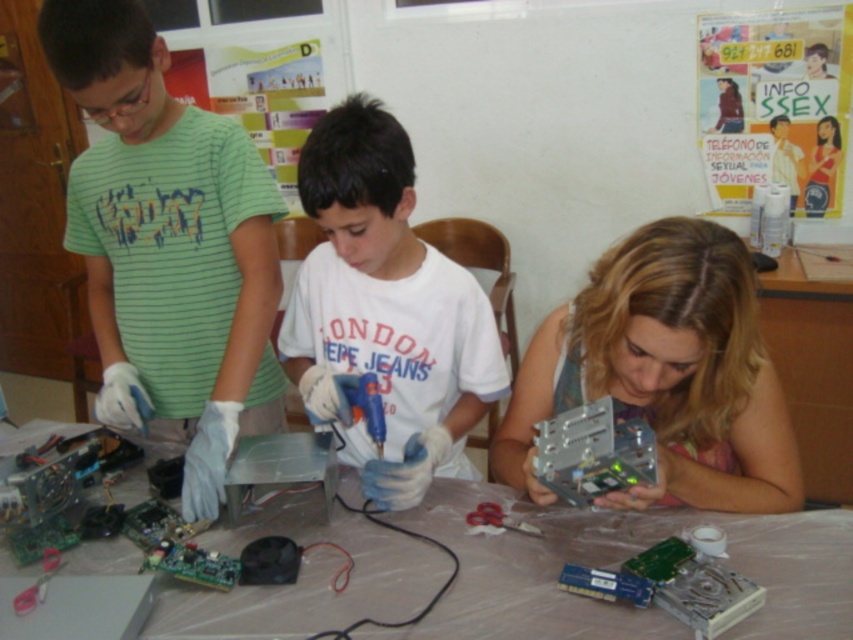
In the scene shown: Which of these two, clear plastic table at center or metallic circuit board at lower right, stands taller?

metallic circuit board at lower right is taller.

Which is below, clear plastic table at center or metallic circuit board at lower right?

clear plastic table at center is below.

Who is more distant from viewer, (322, 515) or (596, 404)?

Point (322, 515)

Locate an element on the screen. clear plastic table at center is located at coordinates (618, 563).

Is metallic gray electronic device at lower right in front of metallic circuit board at lower right?

That is True.

Does metallic gray electronic device at lower right appear under metallic circuit board at lower right?

Incorrect, metallic gray electronic device at lower right is not positioned below metallic circuit board at lower right.

Is point (643, 500) more distant than point (564, 413)?

No, (643, 500) is in front of (564, 413).

This screenshot has height=640, width=853. Identify the location of metallic gray electronic device at lower right. (665, 372).

Is green striped shirt at left taller than white matte glue gun at center?

Yes.

Who is lower down, green striped shirt at left or white matte glue gun at center?

white matte glue gun at center is lower down.

Find the location of a particular element. The width and height of the screenshot is (853, 640). green striped shirt at left is located at coordinates click(x=167, y=248).